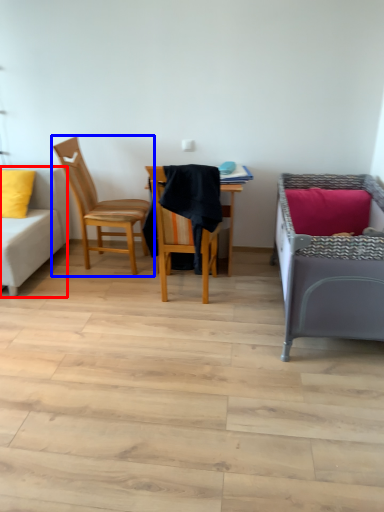
Question: Which of the following is the farthest to the observer, studio couch (highlighted by a red box) or chair (highlighted by a blue box)?

Choices:
 (A) studio couch
 (B) chair

Answer: (B)